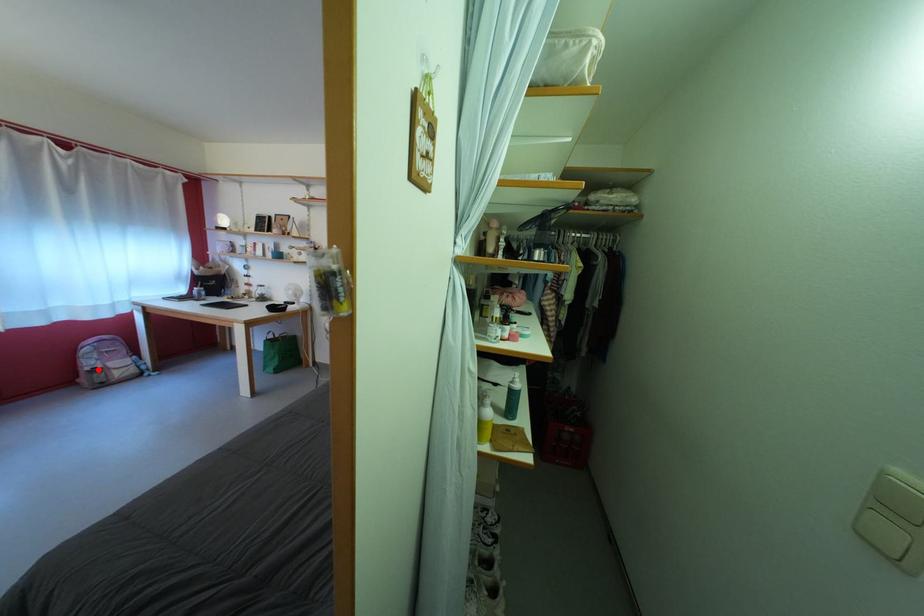
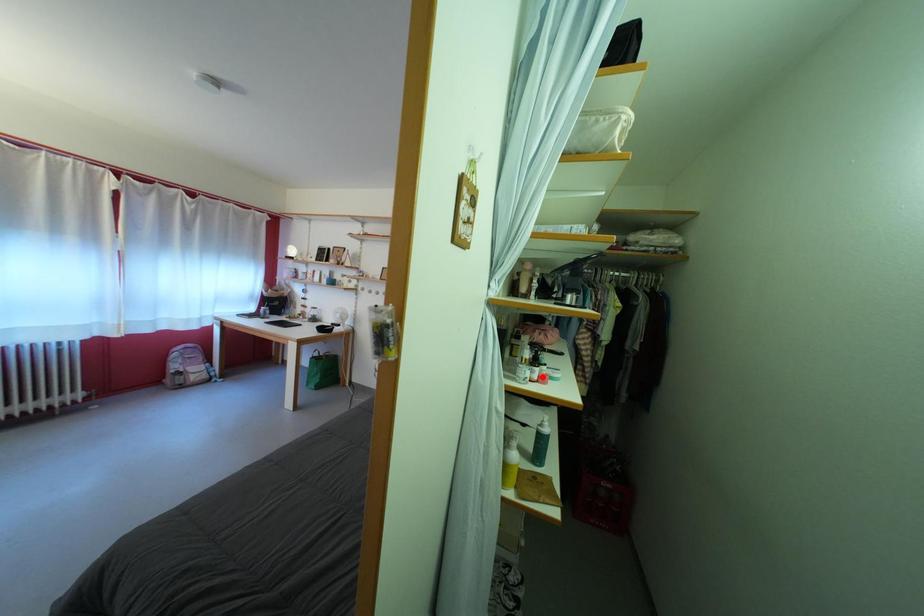
I am providing you with two images of the same scene from different viewpoints. A red point is marked on the first image and another point is marked on the second image. Does the point marked in image1 correspond to the same location as the one in image2?

No